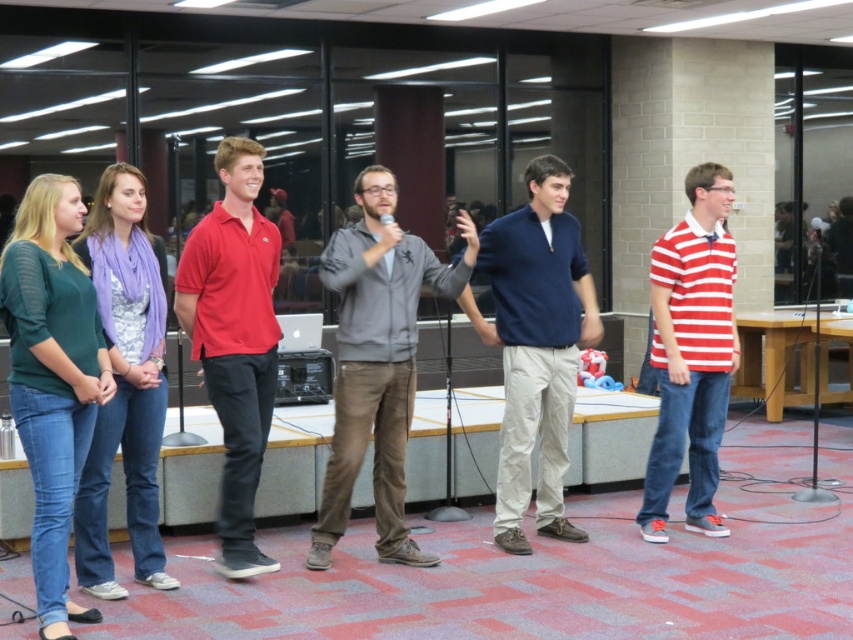
Question: Is green sheer top at left behind blue cotton shirt at center?

Choices:
 (A) yes
 (B) no

Answer: (B)

Question: In this image, where is blue cotton shirt at center located relative to striped cotton shirt at right?

Choices:
 (A) right
 (B) left

Answer: (B)

Question: Estimate the real-world distances between objects in this image. Which object is farther from the purple scarf at left?

Choices:
 (A) green sheer top at left
 (B) blue cotton shirt at center

Answer: (B)

Question: Does gray zip-up jacket at center appear under purple scarf at left?

Choices:
 (A) yes
 (B) no

Answer: (B)

Question: Which of the following is the closest to the observer?

Choices:
 (A) (706, 308)
 (B) (502, 360)
 (C) (44, 337)
 (D) (146, 413)

Answer: (C)

Question: Which point appears closest to the camera in this image?

Choices:
 (A) (265, 445)
 (B) (517, 470)
 (C) (703, 324)

Answer: (A)